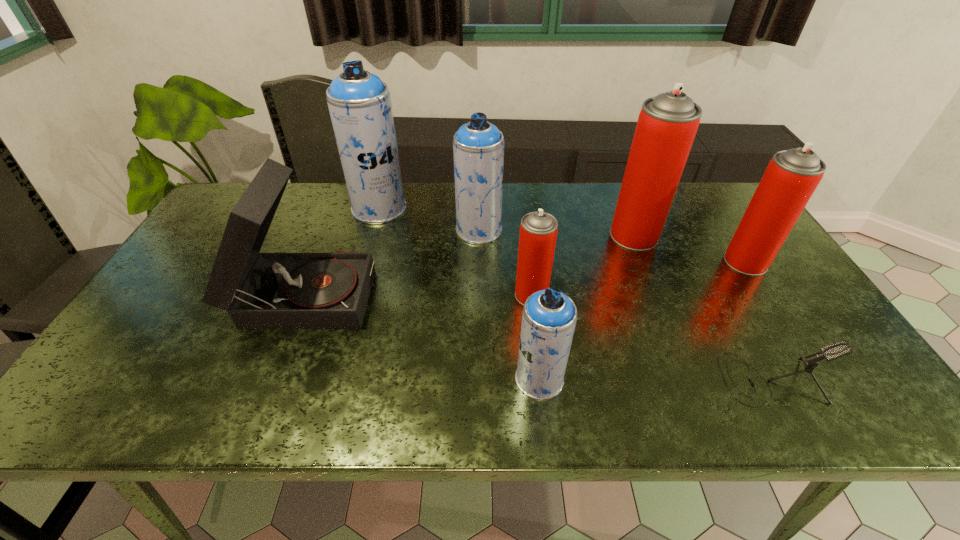
Identify the location of the nearest red aerosol can. (538, 230).

Where is `the nearest aerosol can`? the nearest aerosol can is located at coordinates (549, 317).

Image resolution: width=960 pixels, height=540 pixels. I want to click on the nearest blue aerosol can, so click(x=549, y=317).

At what (x,y) coordinates should I click in order to perform the action: click on microphone. Please return your answer as a coordinate pair (x, y). The image size is (960, 540). Looking at the image, I should click on (834, 351).

Find the location of `free space located 0.070m on the front of the second red aerosol can from right to left`. free space located 0.070m on the front of the second red aerosol can from right to left is located at coordinates (647, 268).

Find the location of a particular element. This screenshot has height=540, width=960. free space located on the front of the biggest blue aerosol can is located at coordinates (x=371, y=237).

Where is `vacant space located 0.240m on the front of the second smallest red aerosol can`? vacant space located 0.240m on the front of the second smallest red aerosol can is located at coordinates (801, 347).

Identify the location of vacant space located on the right of the second biggest blue aerosol can. This screenshot has width=960, height=540. (535, 230).

The image size is (960, 540). In order to click on free spot located 0.400m on the front-facing side of the phonograph_record in this screenshot , I will do `click(523, 291)`.

Where is `free region located on the right of the leftmost red aerosol can`? This screenshot has width=960, height=540. free region located on the right of the leftmost red aerosol can is located at coordinates (644, 295).